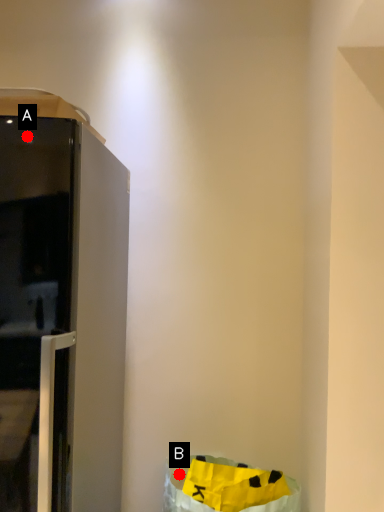
Question: Two points are circled on the image, labeled by A and B beside each circle. Which point is farther from the camera taking this photo?

Choices:
 (A) A is further
 (B) B is further

Answer: (B)